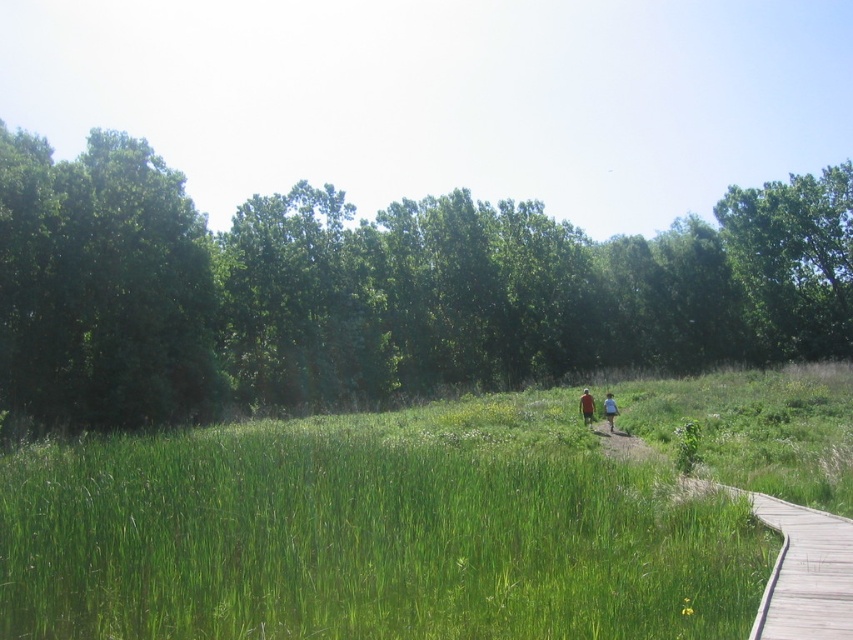
Is green leafy tree at center closer to the viewer compared to green leafy tree at left?

No, green leafy tree at center is further to the viewer.

Consider the image. Is green leafy tree at center below green leafy tree at left?

Actually, green leafy tree at center is above green leafy tree at left.

You are a GUI agent. You are given a task and a screenshot of the screen. Output one action in this format:
    pyautogui.click(x=<x>, y=<y>)
    Task: Click on the green leafy tree at center
    This screenshot has height=640, width=853.
    Given the screenshot: What is the action you would take?
    pyautogui.click(x=378, y=291)

This screenshot has width=853, height=640. In order to click on green leafy tree at center in this screenshot , I will do `click(378, 291)`.

Consider the image. Is green leafy tree at left shorter than wooden boardwalk at lower right?

No.

Which is behind, point (115, 356) or point (805, 563)?

Point (115, 356)

Identify the location of green leafy tree at left. (103, 289).

Does green leafy tree at center appear on the left side of green grassy couple at center?

Correct, you'll find green leafy tree at center to the left of green grassy couple at center.

Does point (776, 273) come behind point (611, 400)?

Yes.

Image resolution: width=853 pixels, height=640 pixels. In order to click on green leafy tree at center in this screenshot , I will do `click(378, 291)`.